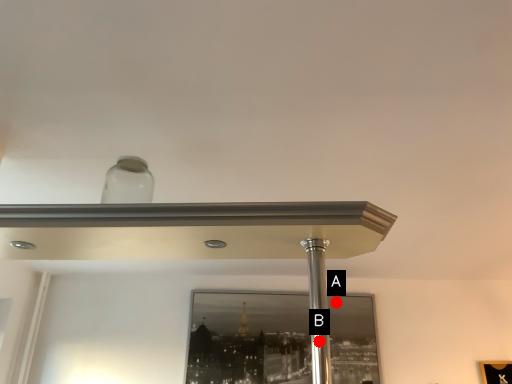
Question: Two points are circled on the image, labeled by A and B beside each circle. Among these points, which one is nearest to the camera?

Choices:
 (A) A is closer
 (B) B is closer

Answer: (B)